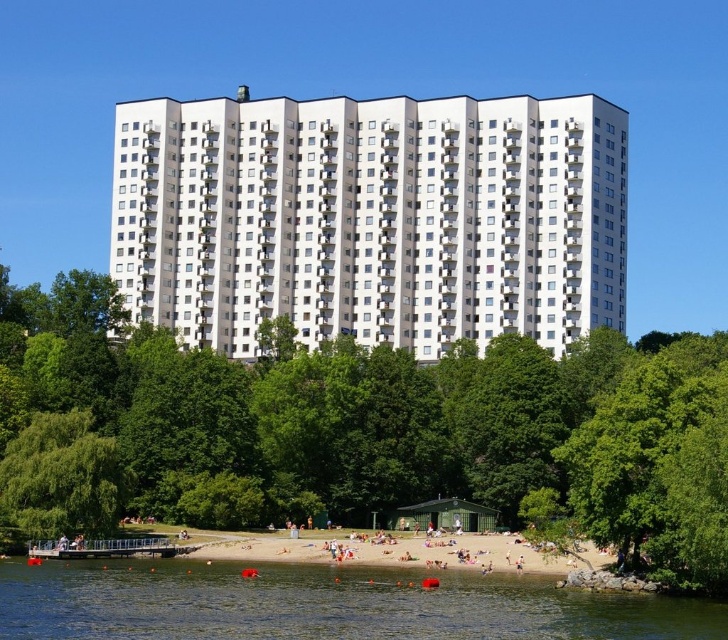
You are standing at the beach near the residential building and want to reach the point marked as point (119, 467). However, there is an obstacle at point (39, 625) blocking your path. Can you walk around the obstacle to reach your destination?

Yes, you can walk around the obstacle at point (39, 625) to reach point (119, 467) because the obstacle is in front of your destination, so you can go around it either to the left or right side of the obstacle.

You are a photographer trying to capture the clear water at lower center and the green leafy tree at lower left in the same frame. Based on their positions, which object would appear closer to the camera in your photo?

The clear water at lower center appears closer to the camera because it is positioned in front of the green leafy tree at lower left.